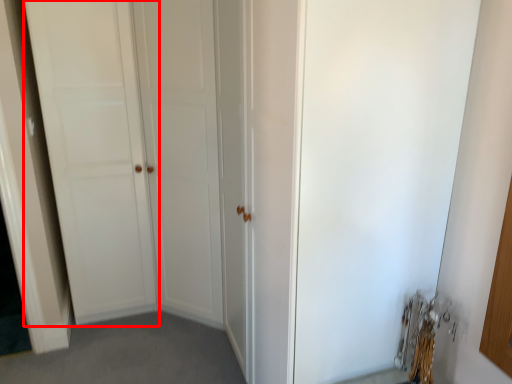
Question: From the image's perspective, what is the correct spatial relationship of door (annotated by the red box) in relation to screen door?

Choices:
 (A) above
 (B) below

Answer: (A)